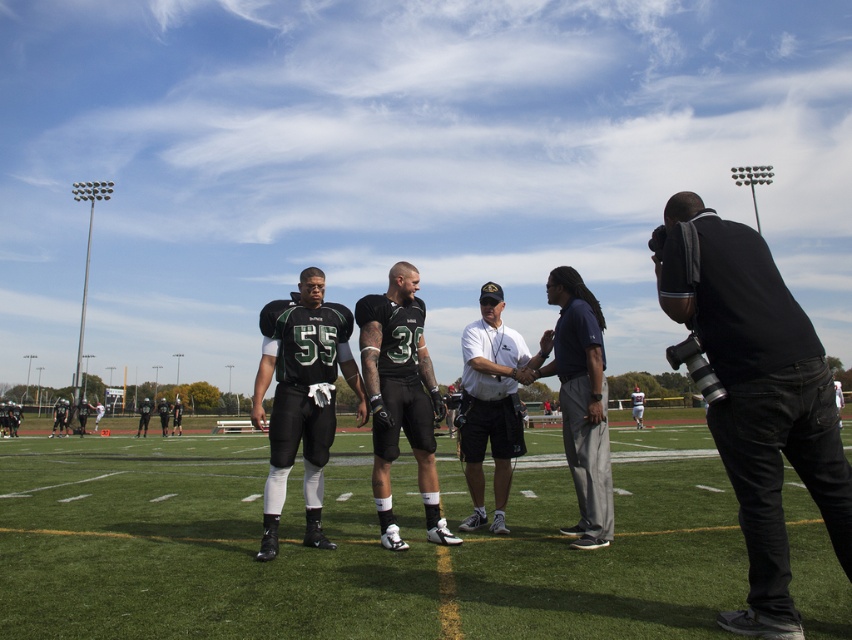
Question: Can you confirm if black matte uniform at center is positioned to the right of white shirt at center?

Choices:
 (A) yes
 (B) no

Answer: (B)

Question: Is black fabric camera at right smaller than matte black football uniform at center?

Choices:
 (A) yes
 (B) no

Answer: (B)

Question: Which point appears closest to the camera in this image?

Choices:
 (A) (285, 355)
 (B) (804, 387)
 (C) (304, 536)
 (D) (491, 328)

Answer: (B)

Question: Is matte black football uniform at center below white shirt at center?

Choices:
 (A) no
 (B) yes

Answer: (A)

Question: Which point is farther to the camera?

Choices:
 (A) (263, 339)
 (B) (479, 404)
 (C) (784, 300)

Answer: (B)

Question: Which point appears closest to the camera in this image?

Choices:
 (A) (482, 481)
 (B) (427, 525)
 (C) (332, 403)
 (D) (401, 294)

Answer: (B)